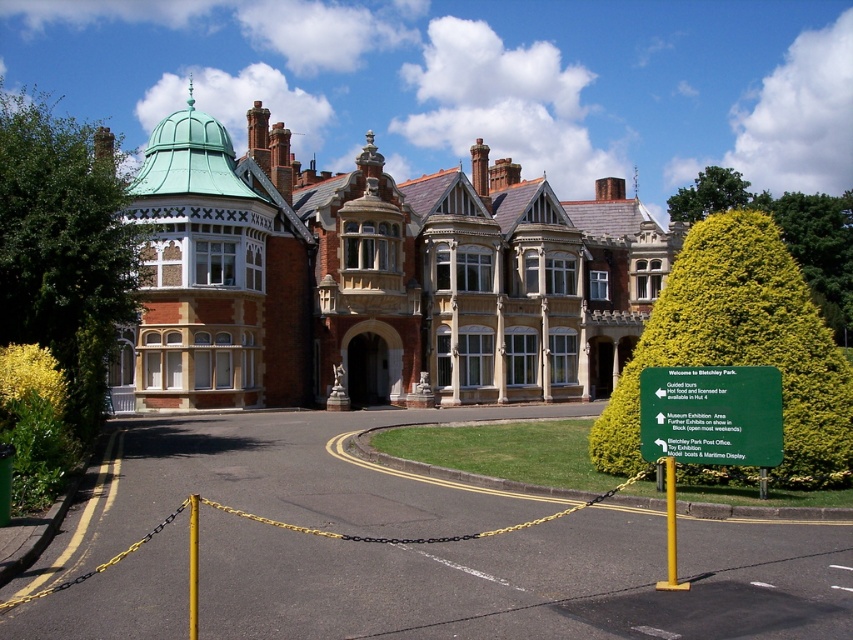
Question: Can you confirm if green leafy bush at center is thinner than green leafy tree at upper center?

Choices:
 (A) yes
 (B) no

Answer: (A)

Question: Is green leafy tree at upper left positioned in front of green plastic signpost at center?

Choices:
 (A) no
 (B) yes

Answer: (A)

Question: Which of the following is the closest to the observer?

Choices:
 (A) green leafy tree at upper left
 (B) green plastic signpost at center
 (C) green plastic sign at center
 (D) brick mansion at center

Answer: (B)

Question: Estimate the real-world distances between objects in this image. Which object is farther from the brick mansion at center?

Choices:
 (A) green leafy tree at upper center
 (B) yellow chain-link fence at center
 (C) green leafy bush at center

Answer: (A)

Question: Which of these objects is positioned closest to the yellow chain-link fence at center?

Choices:
 (A) brick mansion at center
 (B) green plastic signpost at center
 (C) green leafy tree at upper center

Answer: (B)

Question: Is brick mansion at center above green leafy tree at upper left?

Choices:
 (A) no
 (B) yes

Answer: (A)